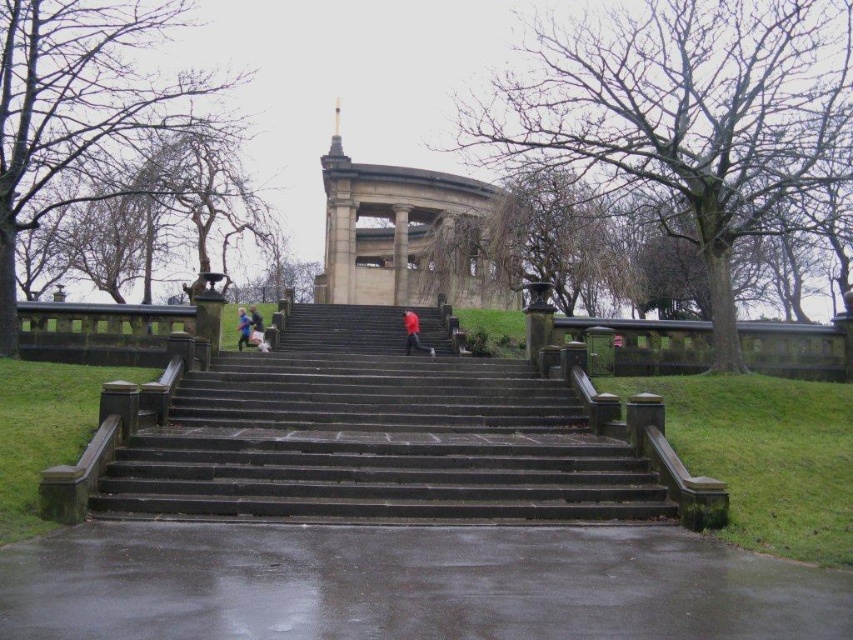
You are standing at the bottom of the dark stone stairs at center and want to reach the red matte jacket at center. Which direction should you move in to get closer to the jacket?

You should move upward along the dark stone stairs at center to get closer to the red matte jacket at center since the stairs are located below the jacket.

You are standing at the bottom of the dark stone stairs at center and want to move towards the red jacket at center. Which direction should you go?

You should move to the left because the dark stone stairs at center are to the right of the red jacket at center, so moving left from the stairs will take you toward the jacket.